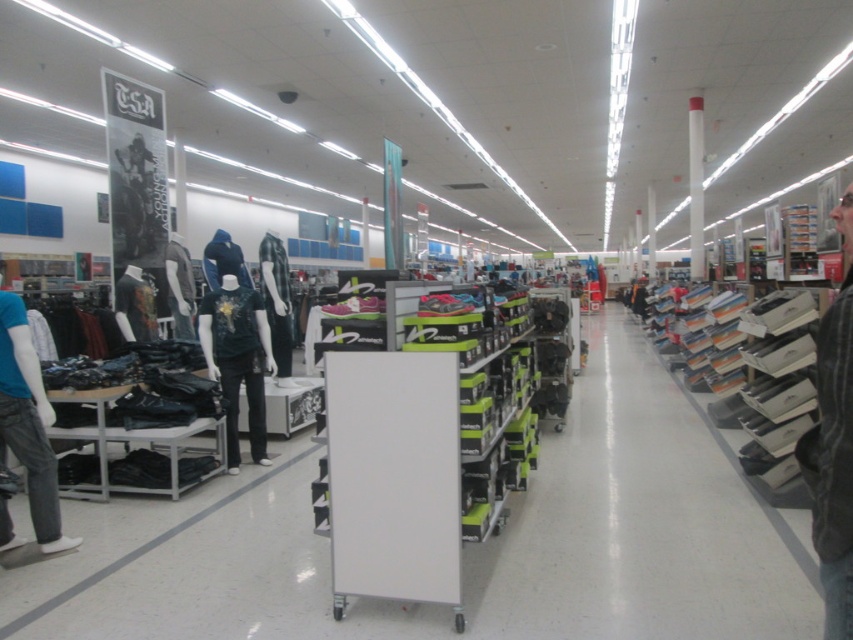
Question: Estimate the real-world distances between objects in this image. Which object is farther from the black leather jacket at right?

Choices:
 (A) dark green jersey at center
 (B) denim jeans at left

Answer: (A)

Question: Does denim jeans at left appear on the right side of dark green jersey at center?

Choices:
 (A) yes
 (B) no

Answer: (B)

Question: Can you confirm if black leather jacket at right is positioned above denim jeans at left?

Choices:
 (A) no
 (B) yes

Answer: (B)

Question: Which point is farther to the camera?

Choices:
 (A) denim jeans at left
 (B) dark green jersey at center

Answer: (B)

Question: Which of the following is the farthest from the observer?

Choices:
 (A) denim jeans at left
 (B) dark green jersey at center

Answer: (B)

Question: Is black leather jacket at right positioned before dark green jersey at center?

Choices:
 (A) no
 (B) yes

Answer: (B)